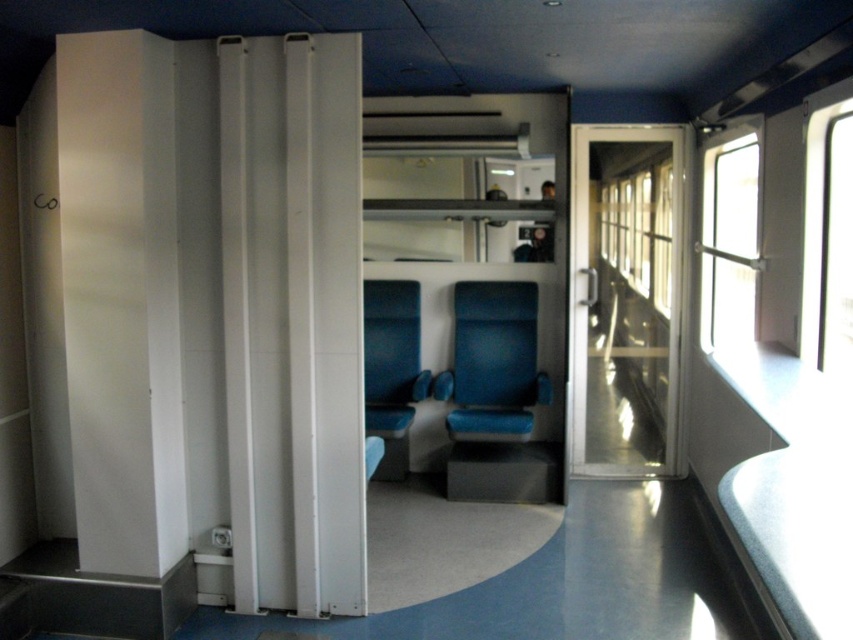
Looking at this image, you are a luggage carrier robot with a width of 24 inches. You need to move from the blue fabric chair at center to the metallic silver coach at center. Can you fit through the space between them?

The distance between the blue fabric chair at center and the metallic silver coach at center is 37.35 inches. Since the robot is 24 inches wide, it can fit through the space as the distance is wider than the robot.